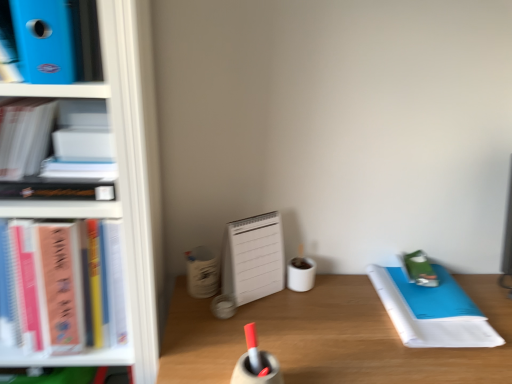
Question: Is point (81, 352) closer or farther from the camera than point (223, 359)?

Choices:
 (A) farther
 (B) closer

Answer: (A)

Question: From a real-world perspective, is pink matte notebook at left, arranged as the 1th book when ordered from the bottom, physically located above or below wooden desk at center?

Choices:
 (A) above
 (B) below

Answer: (A)

Question: Considering the real-world distances, which object is closest to the white matte book at upper left, which appears as the second book when ordered from the bottom?

Choices:
 (A) white paper notebook at right
 (B) wooden desk at center
 (C) green matte notebook at right
 (D) blue plastic folder at upper left, the third book positioned from the bottom
 (E) white plastic bookcase at left

Answer: (D)

Question: Estimate the real-world distances between objects in this image. Which object is farther from the white plastic bookcase at left?

Choices:
 (A) white paper notebook at right
 (B) white matte book at upper left, the second book positioned from the top
 (C) wooden desk at center
 (D) blue plastic folder at upper left, the third book positioned from the bottom
 (E) pink matte notebook at left, placed as the third book when sorted from top to bottom

Answer: (A)